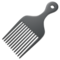
At what (x,y) coordinates should I click in order to perform the action: click on handle. Please return your answer as a coordinate pair (x, y). The width and height of the screenshot is (60, 60). Looking at the image, I should click on (45, 14).